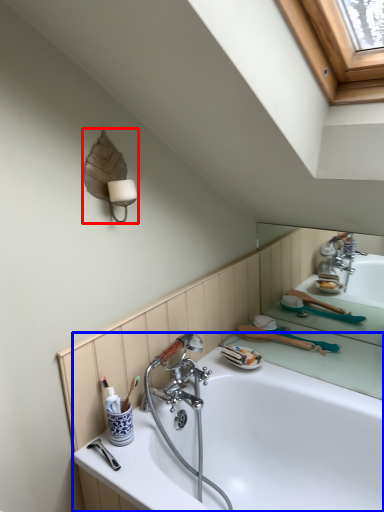
Question: Which object is closer to the camera taking this photo, lamp (highlighted by a red box) or bathtub (highlighted by a blue box)?

Choices:
 (A) lamp
 (B) bathtub

Answer: (B)